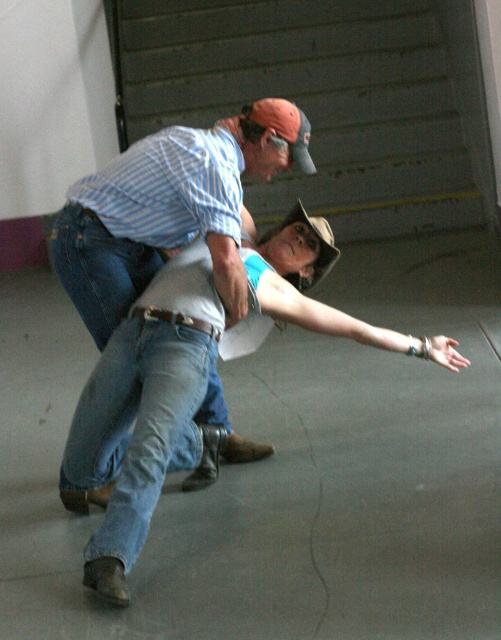
Question: Is the position of denim jeans at center less distant than that of blue denim jeans at lower left?

Choices:
 (A) no
 (B) yes

Answer: (B)

Question: Which point is closer to the camera?

Choices:
 (A) (68, 248)
 (B) (108, 396)

Answer: (B)

Question: Which point appears closest to the camera in this image?

Choices:
 (A) (121, 580)
 (B) (138, 426)

Answer: (A)

Question: Can you confirm if blue striped shirt at upper left is bigger than blue denim jeans at lower left?

Choices:
 (A) yes
 (B) no

Answer: (A)

Question: Which object is closer to the camera taking this photo?

Choices:
 (A) blue denim jeans at lower left
 (B) denim jeans at center
 (C) blue striped shirt at upper left

Answer: (B)

Question: Does denim jeans at center have a greater width compared to blue striped shirt at upper left?

Choices:
 (A) yes
 (B) no

Answer: (A)